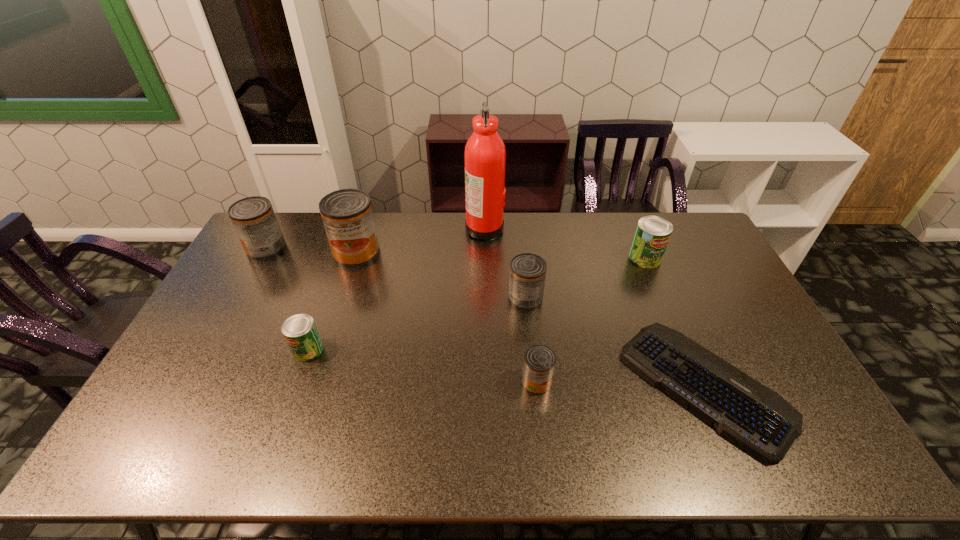
Identify the location of vacant area located 0.170m on the back of the third nearest can. (520, 253).

At what (x,y) coordinates should I click in order to perform the action: click on vacant space located on the back of the smaller green can. Please return your answer as a coordinate pair (x, y). The height and width of the screenshot is (540, 960). Looking at the image, I should click on (340, 259).

Find the location of `free space located 0.370m on the back of the nearest red can`. free space located 0.370m on the back of the nearest red can is located at coordinates (525, 278).

Image resolution: width=960 pixels, height=540 pixels. In order to click on free space located 0.220m on the left of the computer keyboard in this screenshot , I will do `click(546, 386)`.

This screenshot has width=960, height=540. What are the coordinates of `fire extinguisher that is at the far edge` in the screenshot? It's located at (485, 155).

You are a GUI agent. You are given a task and a screenshot of the screen. Output one action in this format:
    pyautogui.click(x=<x>, y=<y>)
    Task: Click on the object that is positioned at the near edge
    This screenshot has height=540, width=960.
    Given the screenshot: What is the action you would take?
    pyautogui.click(x=755, y=417)

Find the location of `object situated at the left edge`. object situated at the left edge is located at coordinates tap(254, 219).

Find the location of a particular element. object present at the right edge is located at coordinates (755, 417).

You are a GUI agent. You are given a task and a screenshot of the screen. Output one action in this format:
    pyautogui.click(x=<x>, y=<y>)
    Task: Click on the object situated at the far left corner
    
    Given the screenshot: What is the action you would take?
    pyautogui.click(x=254, y=219)

The height and width of the screenshot is (540, 960). What are the coordinates of `object that is positioned at the near right corner` in the screenshot? It's located at (755, 417).